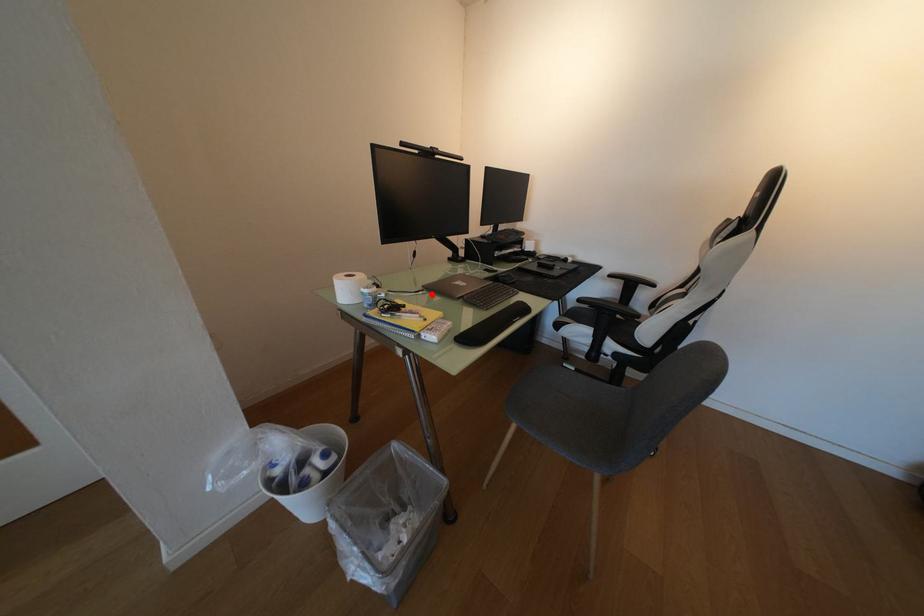
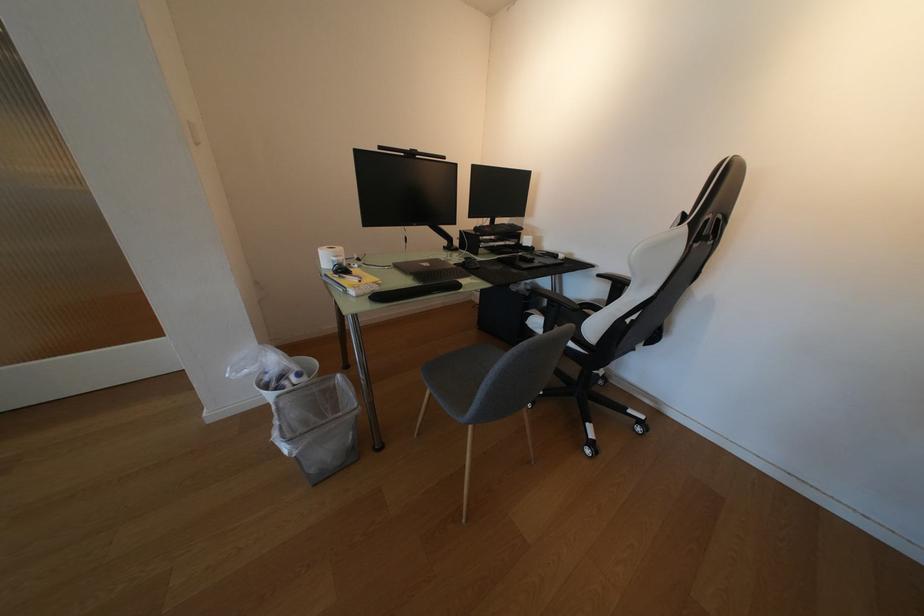
Question: A red point is marked in image1. In image2, is the corresponding 3D point closer to the camera or farther? Reply with the corresponding letter.

Choices:
 (A) The corresponding 3D point is closer.
 (B) The corresponding 3D point is farther.

Answer: (B)